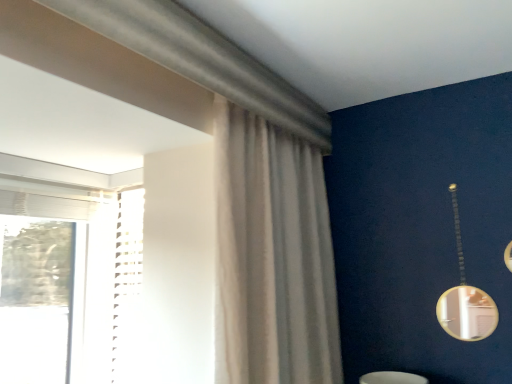
Question: Considering the relative sizes of gold metallic mirror at right and sheer white curtain at center in the image provided, is gold metallic mirror at right taller than sheer white curtain at center?

Choices:
 (A) yes
 (B) no

Answer: (B)

Question: From a real-world perspective, is gold metallic mirror at right under sheer white curtain at center?

Choices:
 (A) no
 (B) yes

Answer: (B)

Question: Are gold metallic mirror at right and sheer white curtain at center located far from each other?

Choices:
 (A) no
 (B) yes

Answer: (A)

Question: Is gold metallic mirror at right oriented towards sheer white curtain at center?

Choices:
 (A) yes
 (B) no

Answer: (B)

Question: From the image's perspective, is gold metallic mirror at right below sheer white curtain at center?

Choices:
 (A) no
 (B) yes

Answer: (B)

Question: Can you confirm if gold metallic mirror at right is bigger than sheer white curtain at center?

Choices:
 (A) yes
 (B) no

Answer: (B)

Question: From the image's perspective, would you say sheer white curtain at center is shown under gold metallic mirror at right?

Choices:
 (A) yes
 (B) no

Answer: (B)

Question: From a real-world perspective, is sheer white curtain at center beneath gold metallic mirror at right?

Choices:
 (A) yes
 (B) no

Answer: (B)

Question: Is sheer white curtain at center thinner than gold metallic mirror at right?

Choices:
 (A) yes
 (B) no

Answer: (B)

Question: Is the depth of sheer white curtain at center less than that of gold metallic mirror at right?

Choices:
 (A) no
 (B) yes

Answer: (B)

Question: Is sheer white curtain at center not close to gold metallic mirror at right?

Choices:
 (A) yes
 (B) no

Answer: (B)

Question: Considering the relative positions of sheer white curtain at center and gold metallic mirror at right in the image provided, is sheer white curtain at center to the right of gold metallic mirror at right from the viewer's perspective?

Choices:
 (A) yes
 (B) no

Answer: (B)

Question: In the image, is sheer white curtain at center positioned in front of or behind gold metallic mirror at right?

Choices:
 (A) front
 (B) behind

Answer: (A)